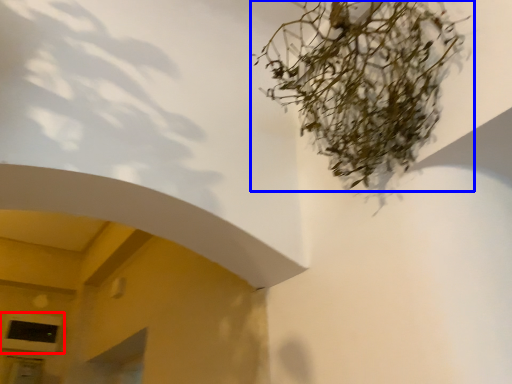
Question: Which object is further to the camera taking this photo, window (highlighted by a red box) or houseplant (highlighted by a blue box)?

Choices:
 (A) window
 (B) houseplant

Answer: (A)